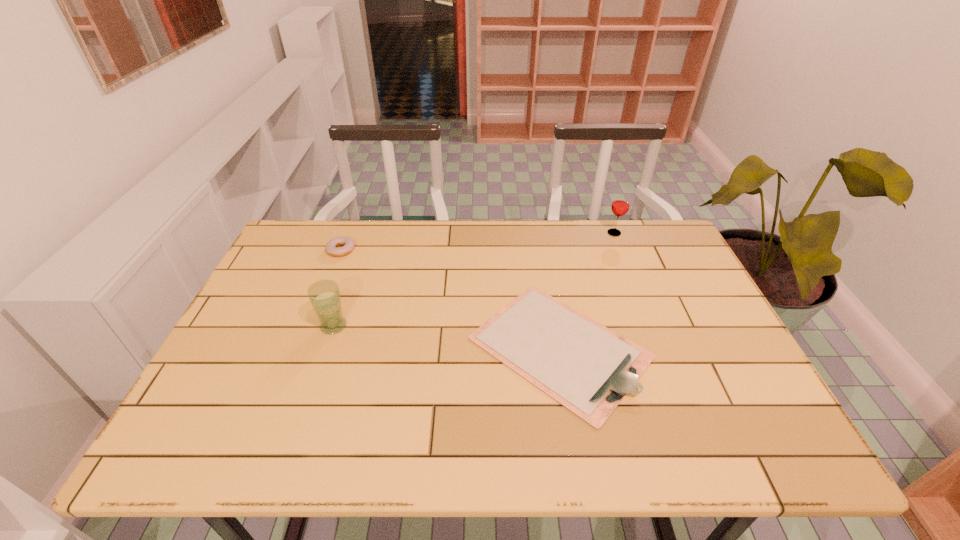
I want to click on the right glass, so click(620, 205).

The image size is (960, 540). What are the coordinates of `the farther glass` in the screenshot? It's located at (620, 205).

The width and height of the screenshot is (960, 540). I want to click on the left glass, so click(324, 295).

The image size is (960, 540). Identify the location of doughnut. (347, 243).

Where is `the second shortest object`? This screenshot has height=540, width=960. the second shortest object is located at coordinates (347, 243).

You are a GUI agent. You are given a task and a screenshot of the screen. Output one action in this format:
    pyautogui.click(x=<x>, y=<y>)
    Task: Click on the shortest object
    The image size is (960, 540).
    Given the screenshot: What is the action you would take?
    pyautogui.click(x=586, y=367)

Locate an element on the screen. blank area located on the left of the farthest object is located at coordinates (496, 233).

At what (x,y) coordinates should I click in order to perform the action: click on free space located 0.400m on the back of the left glass. Please return your answer as a coordinate pair (x, y). Looking at the image, I should click on (367, 229).

This screenshot has width=960, height=540. Find the location of `vacant space located 0.380m on the front of the second farthest object`. vacant space located 0.380m on the front of the second farthest object is located at coordinates (300, 357).

Find the location of a particular element. vacant space located on the front of the clipboard is located at coordinates (578, 453).